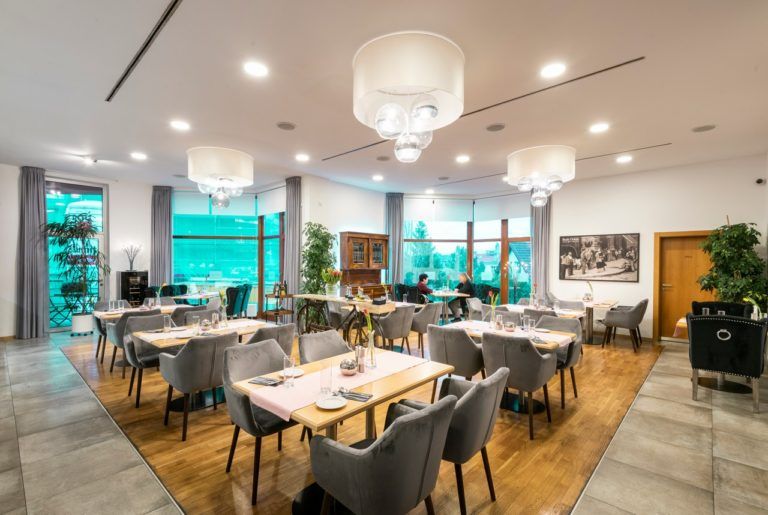
Where is `blinds`? This screenshot has height=515, width=768. blinds is located at coordinates (495, 210), (441, 204), (266, 203), (237, 210), (184, 208).